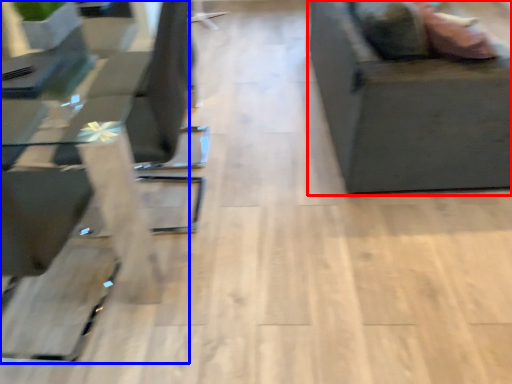
Question: Which of the following is the farthest to the observer, furniture (highlighted by a red box) or table (highlighted by a blue box)?

Choices:
 (A) furniture
 (B) table

Answer: (A)